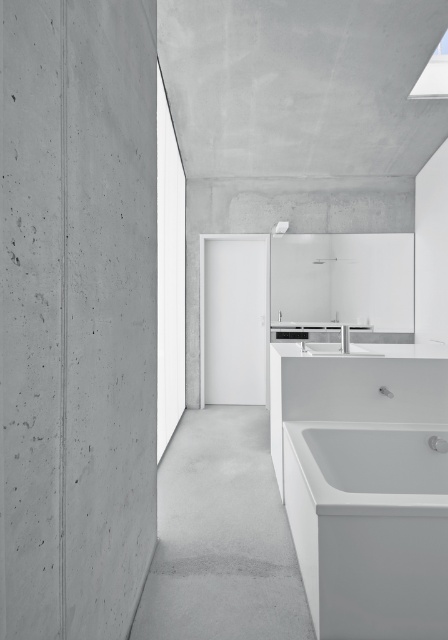
You are planning to place a large potted plant in the bathroom. The potted plant requires a space that is bigger than the white glossy sink at center. Based on the scene description, is the gray concrete floor at center a suitable location for placing the potted plant?

The gray concrete floor at center has a larger size compared to the white glossy sink at center, so it is suitable for placing the large potted plant as it provides enough space.

You are trying to decide whether to place a new rectangular storage cabinet between the white glossy bathtub at lower right and the white glossy sink at center. The cabinet is 1.2 meters wide. Can you fit it between them without moving either fixture?

The white glossy bathtub at lower right might be wider than the white glossy sink at center, so the distance between them is uncertain. Without knowing the exact spacing, it is not possible to confirm if the 1.2 meter wide cabinet will fit. You should measure the space first.